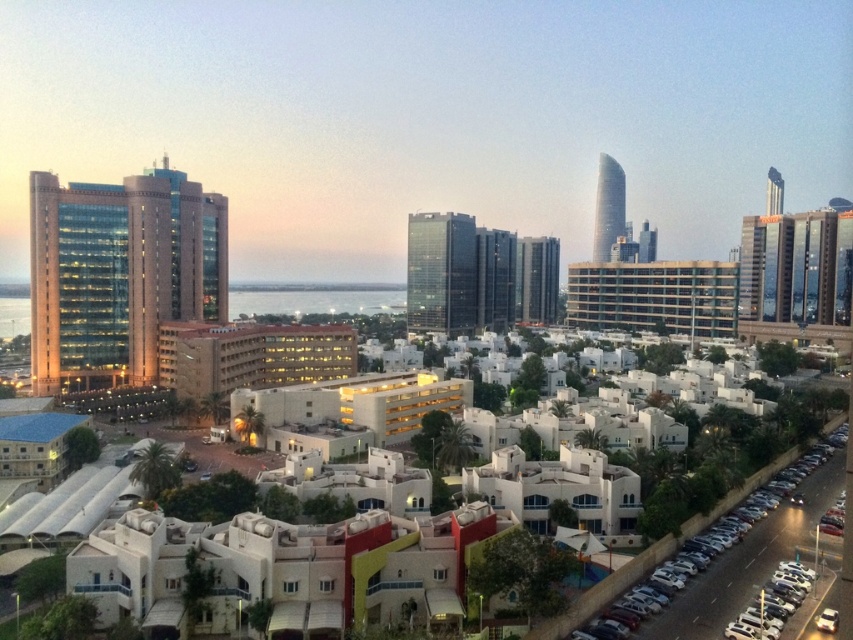
You are a delivery driver needing to park your vehicle between the metallic silver car at lower right and the silver metallic car at lower right. However, you realize both cars are actually the same vehicle captured in a reflection. Given the distance provided, can you safely navigate around this car to park?

The distance between the metallic silver car at lower right and the silver metallic car at lower right is 10.07 meters. Since these are the same car in reflection, there is no actual space between them, so you cannot park between them.

Based on the photo, you are standing at the center of the city looking towards the horizon. There is a metallic silver car at lower right. What is the color of the car located at point (672, 541)?

The metallic silver car at lower right is located at point (672, 541).

You are a delivery driver who needs to park your metallic silver car at lower right and silver metallic car at lower right in a parking lot with limited space. Which car should you park first to ensure both fit in the available space?

You should park the smaller silver metallic car at lower right first because the metallic silver car at lower right is larger, and by placing the smaller one first, there will be enough space left for the larger car.